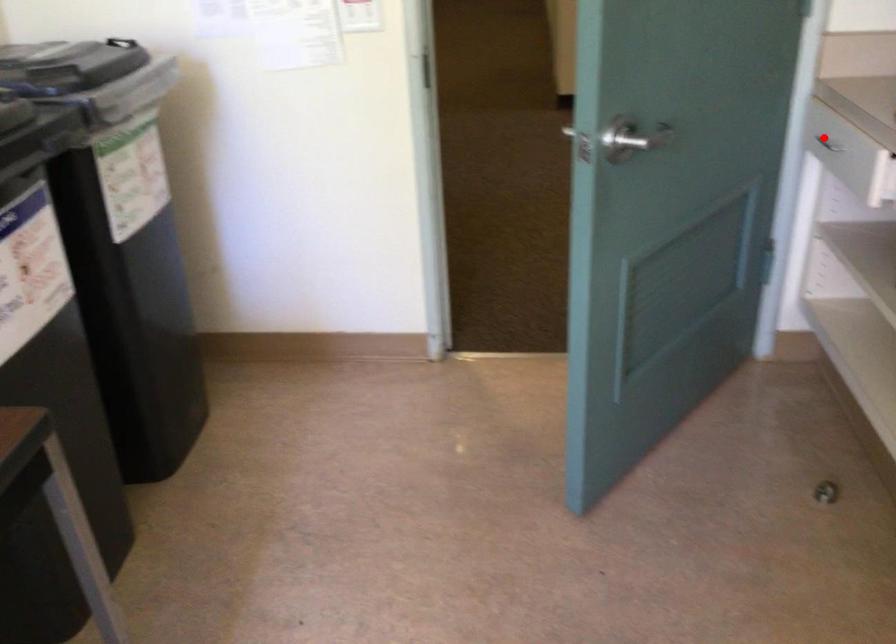
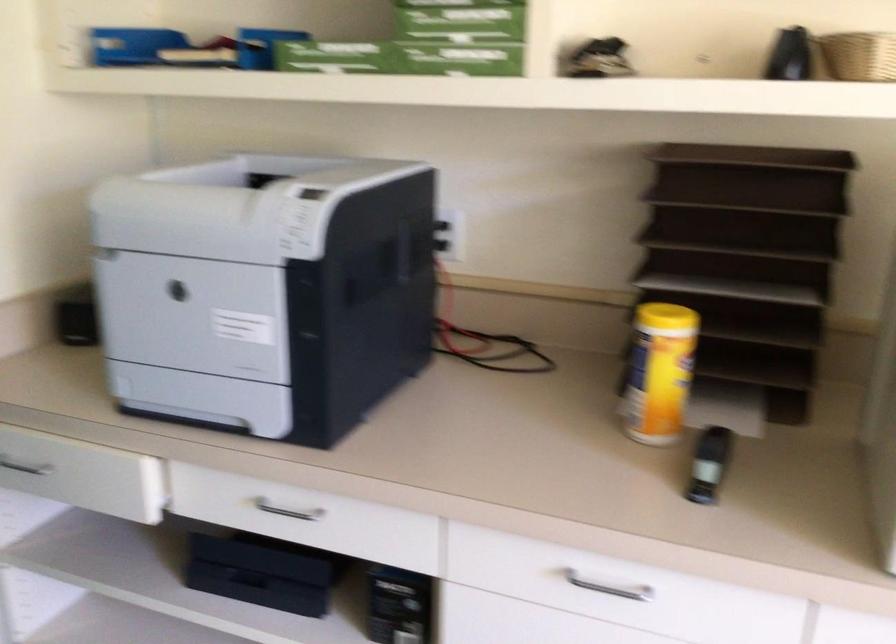
Locate, in the second image, the point that corresponds to the highlighted location in the first image.

(24, 467)